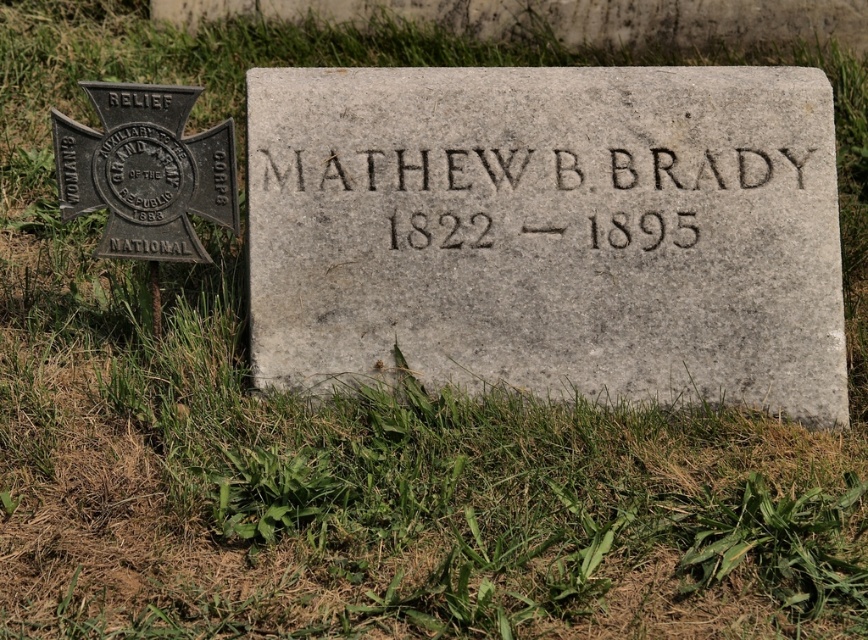
Measure the distance between gray stone gravestone at center and metallic cross at left.

gray stone gravestone at center is 25.44 inches away from metallic cross at left.

Which is below, gray stone gravestone at center or metallic cross at left?

gray stone gravestone at center is lower down.

Locate an element on the screen. gray stone gravestone at center is located at coordinates (549, 230).

The height and width of the screenshot is (640, 868). I want to click on gray stone gravestone at center, so click(549, 230).

Is point (820, 404) positioned before point (684, 164)?

No, (820, 404) is further to viewer.

Can you confirm if gray stone gravestone at center is positioned to the right of black stone engraving at center?

Yes, gray stone gravestone at center is to the right of black stone engraving at center.

You are a GUI agent. You are given a task and a screenshot of the screen. Output one action in this format:
    pyautogui.click(x=<x>, y=<y>)
    Task: Click on the gray stone gravestone at center
    
    Given the screenshot: What is the action you would take?
    pyautogui.click(x=549, y=230)

Locate an element on the screen. The image size is (868, 640). gray stone gravestone at center is located at coordinates (549, 230).

Is black stone engraving at center below metallic cross at left?

Yes, black stone engraving at center is below metallic cross at left.

Is point (366, 176) positioned behind point (162, 216)?

No, it is not.

The width and height of the screenshot is (868, 640). Find the location of `black stone engraving at center`. black stone engraving at center is located at coordinates (525, 172).